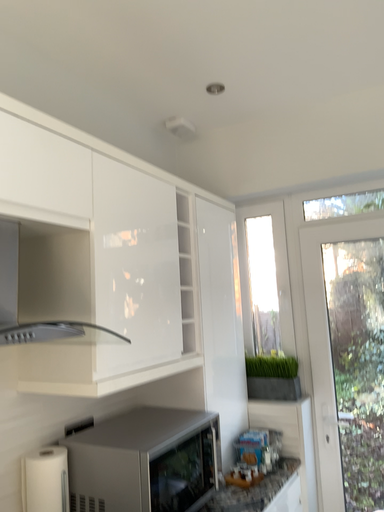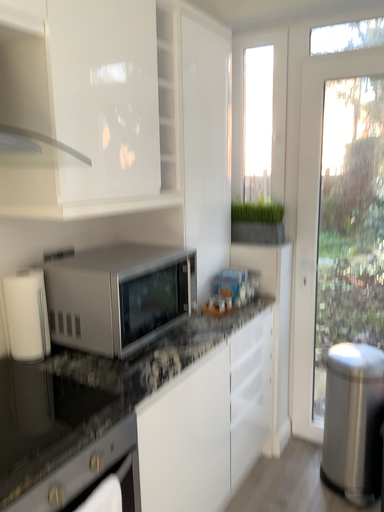
Question: Which way did the camera rotate in the video?

Choices:
 (A) rotated downward
 (B) rotated upward

Answer: (A)